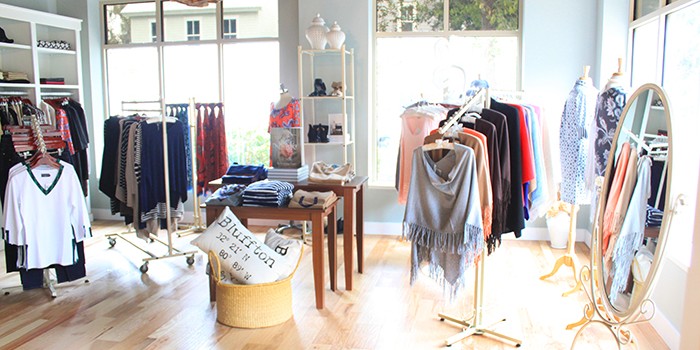
The width and height of the screenshot is (700, 350). I want to click on windows, so click(x=138, y=19), click(x=183, y=19), click(x=232, y=20), click(x=392, y=20), click(x=475, y=15).